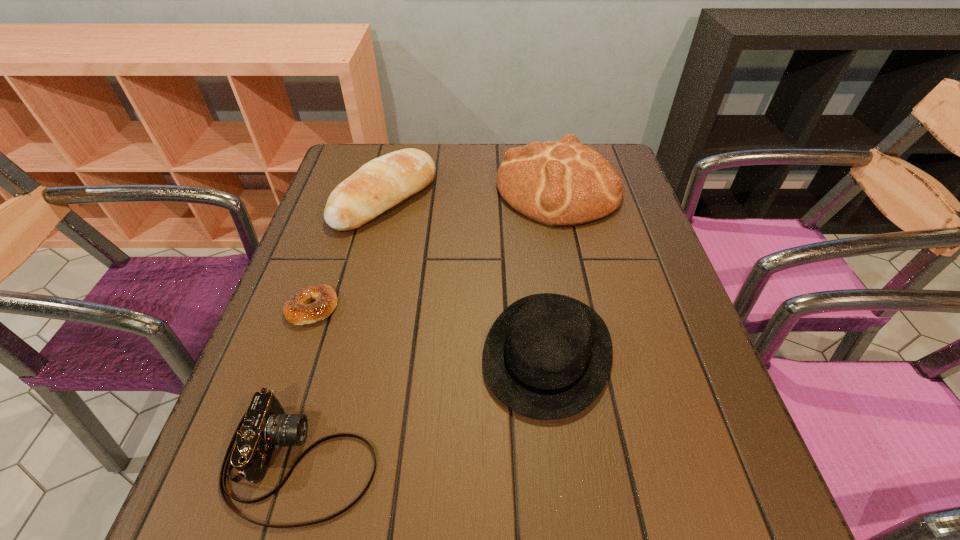
Where is `free spot between the left bread and the third tallest object`? free spot between the left bread and the third tallest object is located at coordinates (466, 275).

Find the location of `free space between the third shortest object and the shorter bread`. free space between the third shortest object and the shorter bread is located at coordinates (466, 275).

The image size is (960, 540). Identify the location of free space between the second tallest object and the fedora. tap(466, 275).

Locate an element on the screen. The image size is (960, 540). vacant point located between the shorter bread and the bagel is located at coordinates tap(348, 253).

Identify the location of free point between the second shortest object and the second tallest object. (344, 329).

Identify which object is located as the fourth nearest to the shortest object. Please provide its 2D coordinates. Your answer should be formatted as a tuple, i.e. [(x, y)], where the tuple contains the x and y coordinates of a point satisfying the conditions above.

[(563, 183)]

Choose which object is the fourth nearest neighbor to the fourth shortest object. Please provide its 2D coordinates. Your answer should be formatted as a tuple, i.e. [(x, y)], where the tuple contains the x and y coordinates of a point satisfying the conditions above.

[(264, 426)]